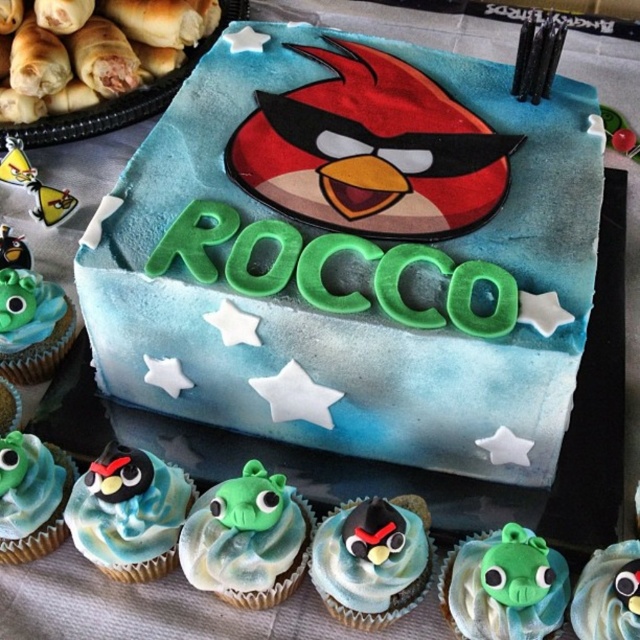
You are a guest at a birthday party and see the cake with the matte blue frosting at center and the matte green fondant angry bird at lower right. Which one is placed higher on the cake?

The matte blue frosting at center is above the matte green fondant angry bird at lower right, so the matte blue frosting at center is placed higher on the cake.

You are a guest at a birthday party and see the green fondant angry bird at center and the matte green fondant angry bird at lower right. Which one is positioned higher on the image?

The green fondant angry bird at center is positioned higher because it is above the matte green fondant angry bird at lower right.